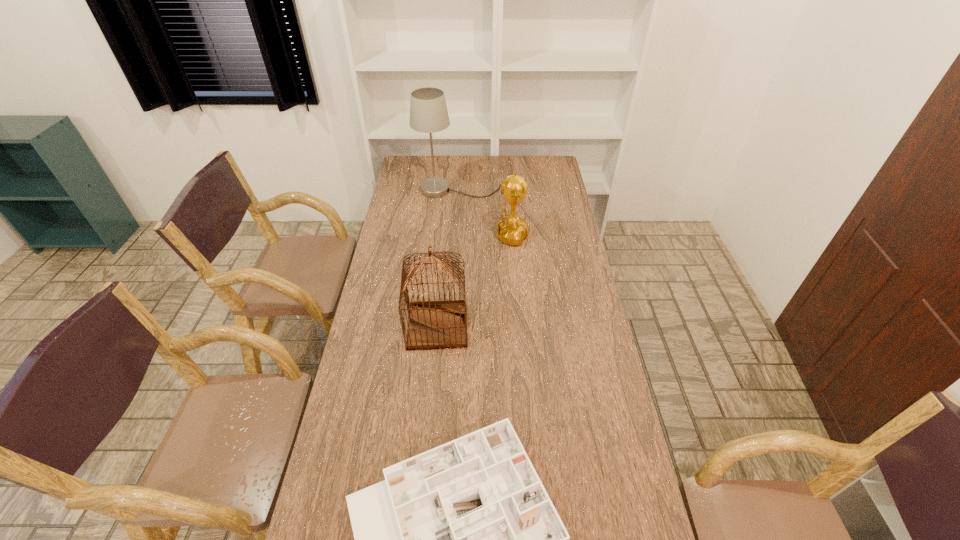
At what (x,y) coordinates should I click in order to perform the action: click on vacant point located on the front side of the award. Please return your answer as a coordinate pair (x, y). Looking at the image, I should click on click(x=469, y=235).

Locate an element on the screen. This screenshot has height=540, width=960. table lamp that is at the left edge is located at coordinates (428, 111).

The image size is (960, 540). Find the location of `birdcage that is at the left edge`. birdcage that is at the left edge is located at coordinates (433, 325).

The width and height of the screenshot is (960, 540). What are the coordinates of `blank space at the left edge of the desktop` in the screenshot? It's located at (393, 200).

I want to click on vacant space at the right edge of the desktop, so click(583, 316).

The image size is (960, 540). I want to click on vacant area that lies between the award and the birdcage, so click(471, 281).

Where is `vacant point located between the award and the second nearest object`? The height and width of the screenshot is (540, 960). vacant point located between the award and the second nearest object is located at coordinates (471, 281).

This screenshot has height=540, width=960. What are the coordinates of `vacant space that is in between the second farthest object and the farthest object` in the screenshot? It's located at (483, 213).

Find the location of a particular element. The width and height of the screenshot is (960, 540). free space between the birdcage and the tallest object is located at coordinates (448, 258).

Choose which object is the second nearest neighbor to the birdcage. Please provide its 2D coordinates. Your answer should be formatted as a tuple, i.e. [(x, y)], where the tuple contains the x and y coordinates of a point satisfying the conditions above.

[(463, 539)]